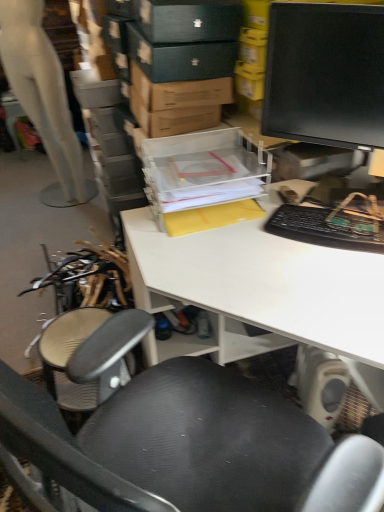
Question: Can you confirm if transparent plastic storage box at center is positioned to the right of matte black monitor at upper right?

Choices:
 (A) yes
 (B) no

Answer: (B)

Question: Would you say transparent plastic storage box at center is outside matte black monitor at upper right?

Choices:
 (A) no
 (B) yes

Answer: (B)

Question: Is matte black monitor at upper right surrounded by transparent plastic storage box at center?

Choices:
 (A) no
 (B) yes

Answer: (A)

Question: Are transparent plastic storage box at center and matte black monitor at upper right beside each other?

Choices:
 (A) yes
 (B) no

Answer: (B)

Question: From a real-world perspective, is transparent plastic storage box at center below matte black monitor at upper right?

Choices:
 (A) no
 (B) yes

Answer: (B)

Question: In terms of width, does black plastic keyboard at right look wider or thinner when compared to white matte mannequin at left?

Choices:
 (A) wide
 (B) thin

Answer: (B)

Question: From the image's perspective, relative to white matte mannequin at left, is black plastic keyboard at right above or below?

Choices:
 (A) above
 (B) below

Answer: (B)

Question: Choose the correct answer: Is black plastic keyboard at right inside white matte mannequin at left or outside it?

Choices:
 (A) outside
 (B) inside

Answer: (A)

Question: Based on their sizes in the image, would you say black plastic keyboard at right is bigger or smaller than white matte mannequin at left?

Choices:
 (A) small
 (B) big

Answer: (A)

Question: Is transparent plastic storage box at center taller or shorter than white matte mannequin at left?

Choices:
 (A) short
 (B) tall

Answer: (A)

Question: From the image's perspective, relative to white matte mannequin at left, is transparent plastic storage box at center above or below?

Choices:
 (A) below
 (B) above

Answer: (A)

Question: In terms of size, does transparent plastic storage box at center appear bigger or smaller than white matte mannequin at left?

Choices:
 (A) big
 (B) small

Answer: (B)

Question: Is transparent plastic storage box at center inside or outside of white matte mannequin at left?

Choices:
 (A) outside
 (B) inside

Answer: (A)

Question: From the image's perspective, relative to black textured chair at center, is white matte mannequin at left above or below?

Choices:
 (A) below
 (B) above

Answer: (B)

Question: Looking at their shapes, would you say white matte mannequin at left is wider or thinner than black textured chair at center?

Choices:
 (A) wide
 (B) thin

Answer: (B)